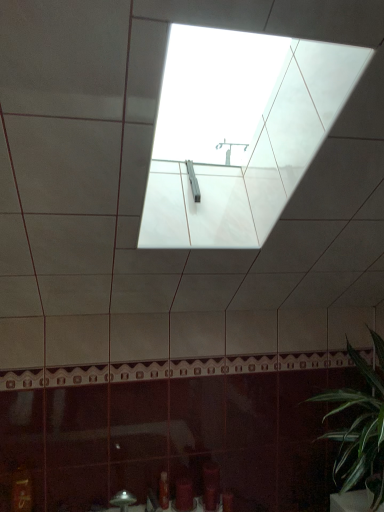
Question: Is translucent plastic bottle at lower center, acting as the 1th toiletry starting from the left, to the left or to the right of matte red toiletry at lower center, arranged as the second toiletry when viewed from the left, in the image?

Choices:
 (A) right
 (B) left

Answer: (B)

Question: Is translucent plastic bottle at lower center, positioned as the 2th toiletry in right-to-left order, inside the boundaries of matte red toiletry at lower center, arranged as the second toiletry when viewed from the left, or outside?

Choices:
 (A) outside
 (B) inside

Answer: (A)

Question: Which object is the farthest from the green leafy plant at lower right?

Choices:
 (A) matte red toiletry at lower center, arranged as the second toiletry when viewed from the left
 (B) translucent plastic bottle at lower center, positioned as the 2th toiletry in right-to-left order

Answer: (B)

Question: Which is farther from the green leafy plant at lower right?

Choices:
 (A) translucent plastic bottle at lower center, acting as the 1th toiletry starting from the left
 (B) matte red toiletry at lower center, the 1th toiletry from the right

Answer: (A)